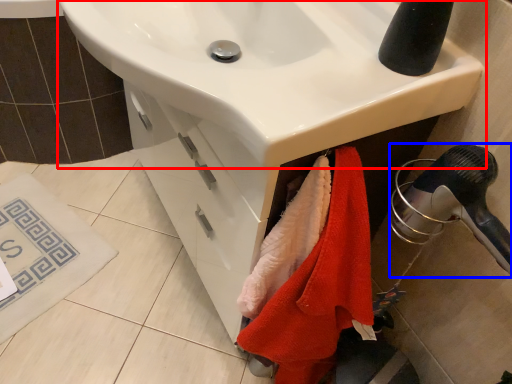
Question: Which of the following is the closest to the observer, sink (highlighted by a red box) or hair drier (highlighted by a blue box)?

Choices:
 (A) sink
 (B) hair drier

Answer: (A)